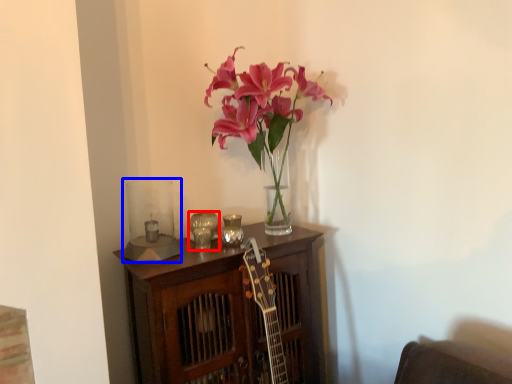
Question: Which of the following is the farthest to the observer, candle holder (highlighted by a red box) or candle holder (highlighted by a blue box)?

Choices:
 (A) candle holder
 (B) candle holder

Answer: (A)